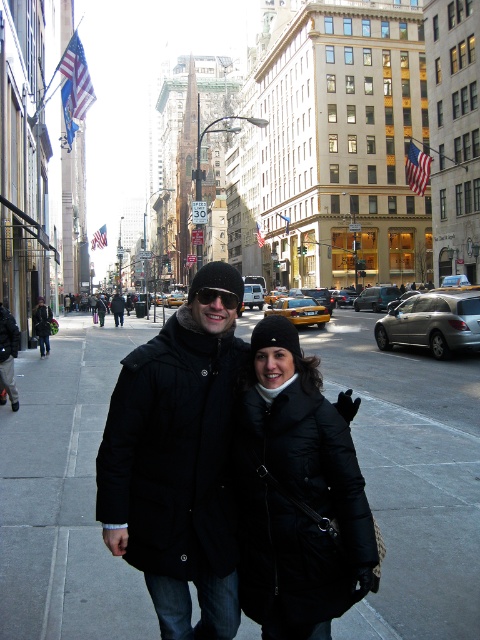
Is point (348, 497) farther from camera compared to point (120, 307)?

No, (348, 497) is in front of (120, 307).

Which is below, black puffy coat at center or black matte jacket at center?

black puffy coat at center is lower down.

Describe the element at coordinates (297, 492) in the screenshot. The width and height of the screenshot is (480, 640). I see `black puffy coat at center` at that location.

Locate an element on the screen. This screenshot has width=480, height=640. black puffy coat at center is located at coordinates (297, 492).

Consider the image. Which is more to the left, black puffy coat at center or sunglasses at center?

sunglasses at center

In the scene shown: Can you confirm if black puffy coat at center is positioned below sunglasses at center?

Correct, black puffy coat at center is located below sunglasses at center.

The image size is (480, 640). Describe the element at coordinates (297, 492) in the screenshot. I see `black puffy coat at center` at that location.

Identify the location of black puffy coat at center. (297, 492).

Does point (225, 292) come in front of point (111, 307)?

Yes, it is in front of point (111, 307).

Is point (218, 289) closer to viewer compared to point (119, 323)?

Yes, it is in front of point (119, 323).

The image size is (480, 640). I want to click on sunglasses at center, so click(x=217, y=296).